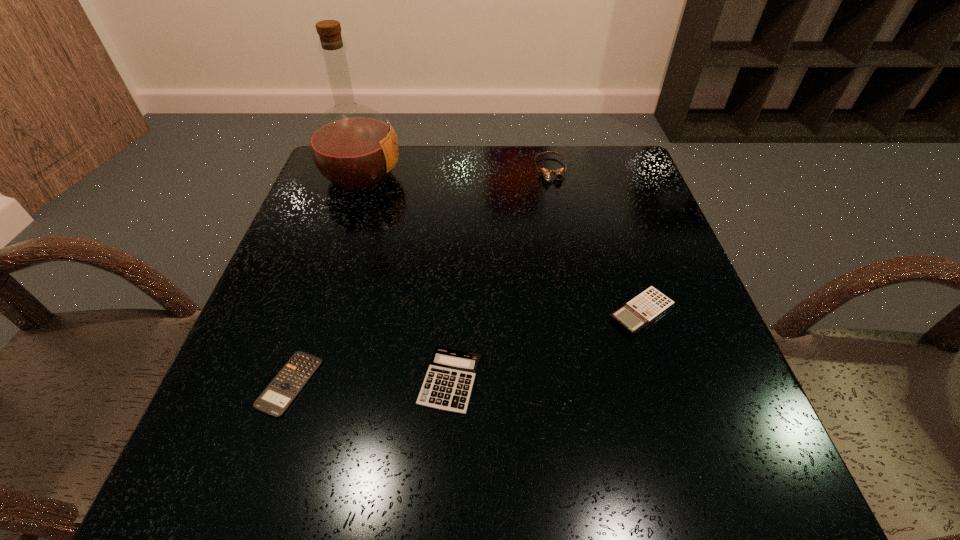
Where is `blank space located on the right of the third object from right to left`? blank space located on the right of the third object from right to left is located at coordinates (600, 381).

You are a GUI agent. You are given a task and a screenshot of the screen. Output one action in this format:
    pyautogui.click(x=<x>, y=<y>)
    Task: Click on the free space located on the back of the farthest calculator
    
    Given the screenshot: What is the action you would take?
    pyautogui.click(x=598, y=181)

In order to click on free space located 0.230m on the back of the shortest calculator in this screenshot , I will do `click(331, 261)`.

This screenshot has height=540, width=960. Find the location of `liquor located at the far edge`. liquor located at the far edge is located at coordinates (353, 146).

The image size is (960, 540). Find the location of `goggles that is at the far edge`. goggles that is at the far edge is located at coordinates (546, 173).

Find the location of a particular element. liquor that is positioned at the left edge is located at coordinates (353, 146).

Identify the location of calculator at the left edge. (280, 393).

Find the location of `object present at the right edge`. object present at the right edge is located at coordinates (647, 306).

Image resolution: width=960 pixels, height=540 pixels. In order to click on object that is positioned at the far left corner in this screenshot , I will do `click(353, 146)`.

The height and width of the screenshot is (540, 960). In order to click on blank space at the far edge in this screenshot , I will do `click(399, 152)`.